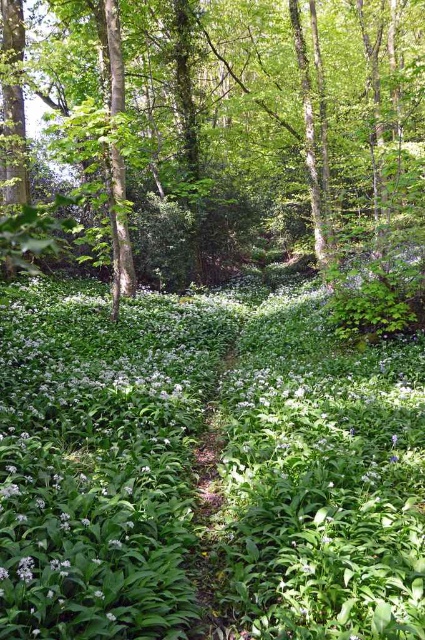
Looking at this image, does white matte flowers at center appear over green leafy tree at center?

Actually, white matte flowers at center is below green leafy tree at center.

Which is behind, point (376, 355) or point (198, 209)?

Positioned behind is point (198, 209).

Identify the location of white matte flowers at center. This screenshot has height=640, width=425. (218, 468).